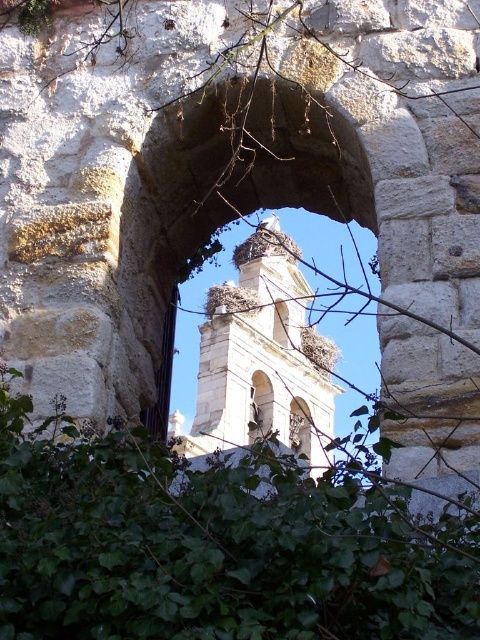
Is the position of green leafy plant at center less distant than that of brown textured nest at center?

Yes.

Is point (14, 605) positioned behind point (230, 298)?

No, it is not.

Where is `green leafy plant at center`? The width and height of the screenshot is (480, 640). green leafy plant at center is located at coordinates coord(214,545).

Is green leafy plant at center closer to the viewer compared to white stone bell tower at center?

That is True.

Is green leafy plant at center to the right of white stone bell tower at center from the viewer's perspective?

In fact, green leafy plant at center is to the left of white stone bell tower at center.

In order to click on green leafy plant at center in this screenshot , I will do `click(214, 545)`.

Which is in front, point (324, 413) or point (218, 307)?

Positioned in front is point (218, 307).

Who is lower down, white stone bell tower at center or brown textured nest at center?

white stone bell tower at center

Describe the element at coordinates (255, 362) in the screenshot. This screenshot has height=640, width=480. I see `white stone bell tower at center` at that location.

The width and height of the screenshot is (480, 640). I want to click on white stone bell tower at center, so click(x=255, y=362).